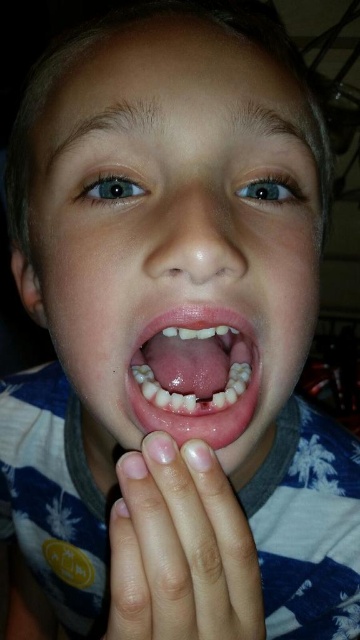
Based on the scene, which object is positioned higher up, the smooth skin face at center or the smooth skin hand at lower center?

The smooth skin face at center is positioned higher up than the smooth skin hand at lower center because it is described as much taller.